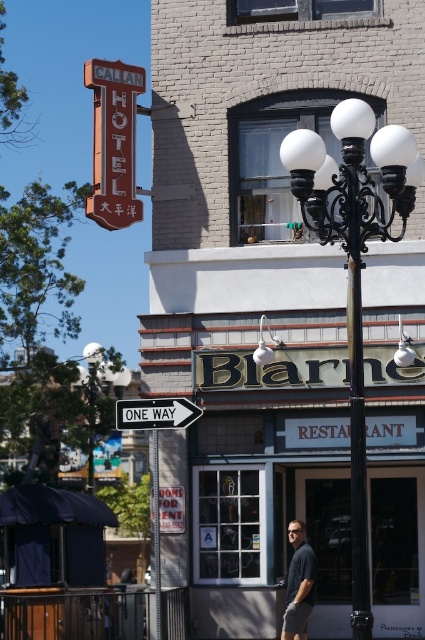
Which is behind, point (181, 531) or point (159, 618)?

The point (181, 531) is more distant.

Can you confirm if red plastic sign at center is shorter than metallic pole at center?

Incorrect, red plastic sign at center's height does not fall short of metallic pole at center's.

Who is more distant from viewer, (159, 522) or (153, 484)?

Point (159, 522)

The width and height of the screenshot is (425, 640). In order to click on red plastic sign at center in this screenshot , I will do `click(172, 509)`.

Does white glass globe streetlight at center appear over white matte lamp at center?

Indeed, white glass globe streetlight at center is positioned over white matte lamp at center.

Can you confirm if white glass globe streetlight at center is positioned to the left of white matte lamp at center?

Answer: In fact, white glass globe streetlight at center is to the right of white matte lamp at center.

Who is more forward, (312, 200) or (260, 355)?

Positioned in front is point (312, 200).

At what (x,y) coordinates should I click in order to perform the action: click on white glass globe streetlight at center. Please return your answer as a coordinate pair (x, y). The width and height of the screenshot is (425, 640). Looking at the image, I should click on (354, 264).

Does point (153, 481) come closer to viewer compared to point (405, 355)?

Yes, point (153, 481) is closer to viewer.

Is metallic pole at center below white glass lamp at center?

Correct, metallic pole at center is located below white glass lamp at center.

Which is behind, point (152, 488) or point (408, 353)?

Positioned behind is point (152, 488).

Image resolution: width=425 pixels, height=640 pixels. Find the location of `metallic pole at center`. metallic pole at center is located at coordinates (155, 531).